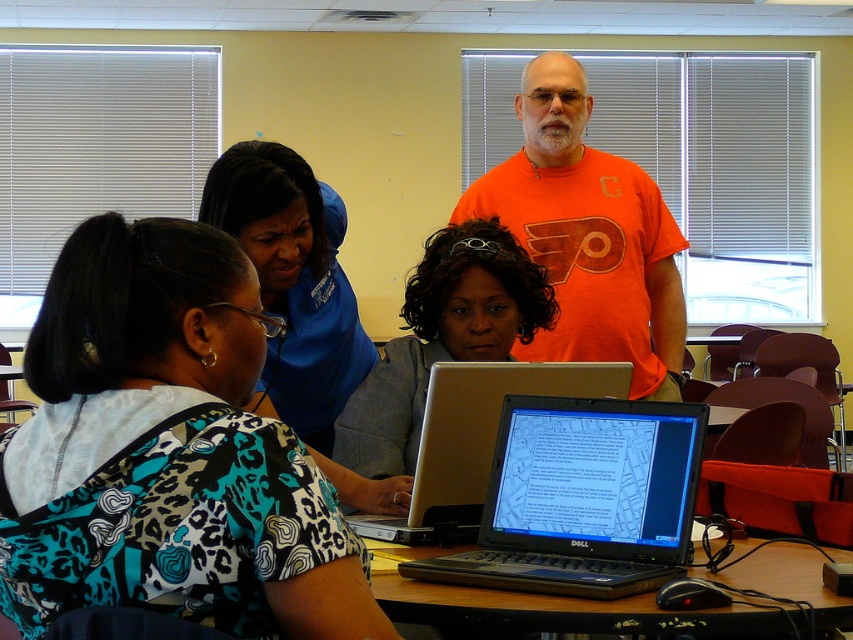
At what (x,y) coordinates should I click in order to perform the action: click on orange cotton t-shirt at center. Please return your answer as a coordinate pair (x, y). This screenshot has width=853, height=640. Looking at the image, I should click on (589, 236).

Between point (584, 104) and point (795, 554), which one is positioned in front?

Point (795, 554) is more forward.

At what (x,y) coordinates should I click in order to perform the action: click on orange cotton t-shirt at center. Please return your answer as a coordinate pair (x, y). Looking at the image, I should click on (589, 236).

Locate an element on the screen. This screenshot has height=640, width=853. orange cotton t-shirt at center is located at coordinates (589, 236).

Based on the photo, is blue fabric shirt at upper center taller than gray fabric shirt at center?

Yes.

Is point (225, 208) closer to camera compared to point (485, 282)?

Yes, point (225, 208) is closer to viewer.

Where is `blue fabric shirt at upper center`? This screenshot has height=640, width=853. blue fabric shirt at upper center is located at coordinates (294, 282).

Which is in front, point (556, 497) or point (318, 292)?

Point (556, 497)

Locate an element on the screen. black plastic laptop at center is located at coordinates (582, 499).

Who is more forward, (646, 460) or (271, 385)?

Point (646, 460)

Where is `black plastic laptop at center`? This screenshot has width=853, height=640. black plastic laptop at center is located at coordinates tap(582, 499).